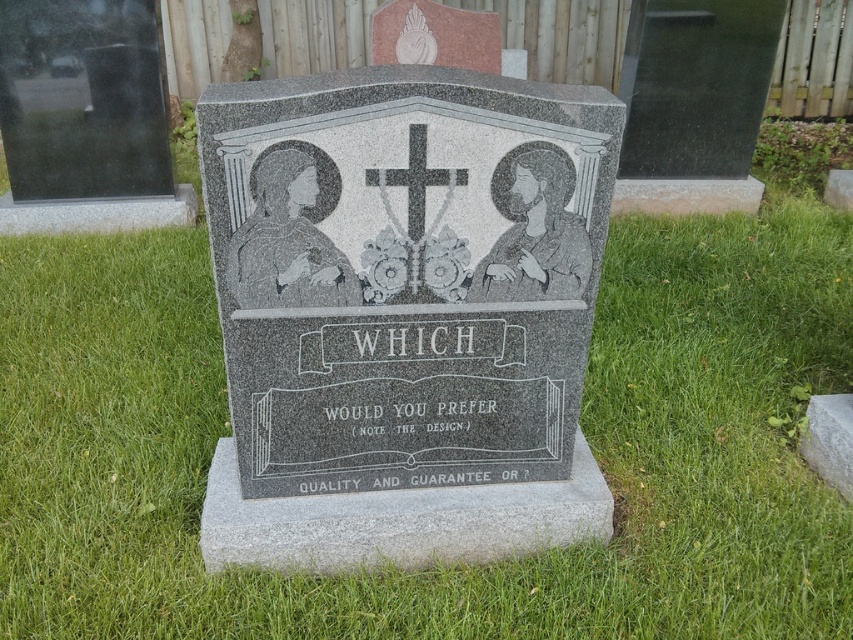
You are standing at the origin point of the image coordinate system. The gravestone with the black cross and religious figures is in front of you. If you walk straight ahead, will you step on the green grass at center before reaching the gravestone?

The green grass at center is located at point (434, 566) in the coordinate system. Since you are starting at the origin, moving straight ahead would first reach the gravestone before the green grass at center, so you would not step on the green grass at center first.